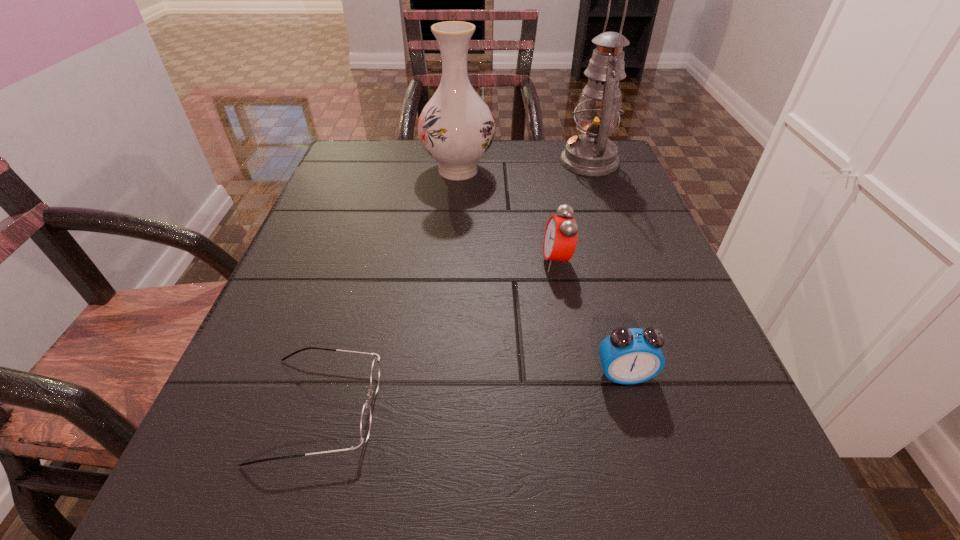
This screenshot has height=540, width=960. I want to click on free space that satisfies the following two spatial constraints: 1. on the face of the fourth tallest object; 2. through the lenses of the shortest object, so click(x=634, y=409).